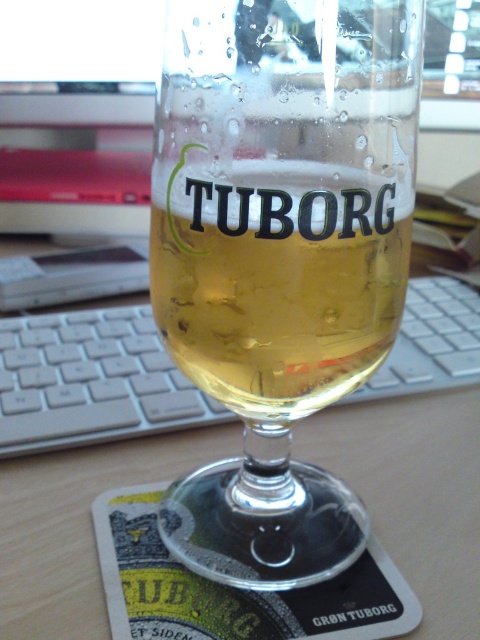
Question: Which object is positioned farthest from the wooden table at center?

Choices:
 (A) translucent glass beer at center
 (B) translucent glass beer glass at center

Answer: (A)

Question: Considering the relative positions of translucent glass beer glass at center and translucent glass beer at center in the image provided, where is translucent glass beer glass at center located with respect to translucent glass beer at center?

Choices:
 (A) below
 (B) above

Answer: (A)

Question: Does translucent glass beer glass at center have a lesser width compared to wooden table at center?

Choices:
 (A) no
 (B) yes

Answer: (B)

Question: Among these points, which one is nearest to the camera?

Choices:
 (A) (211, 195)
 (B) (391, 236)
 (C) (84, 616)

Answer: (A)

Question: Which object is closer to the camera taking this photo?

Choices:
 (A) translucent glass beer glass at center
 (B) wooden table at center

Answer: (A)

Question: Does translucent glass beer at center have a smaller size compared to wooden table at center?

Choices:
 (A) no
 (B) yes

Answer: (B)